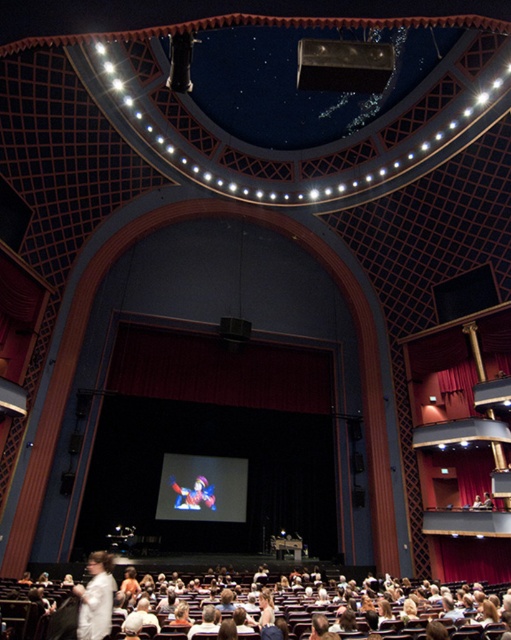
Question: Does white fabric coat at lower center appear on the left side of multicolored plush toy at center?

Choices:
 (A) no
 (B) yes

Answer: (A)

Question: Is white fabric coat at lower center to the right of multicolored plush toy at center from the viewer's perspective?

Choices:
 (A) yes
 (B) no

Answer: (A)

Question: Based on their relative distances, which object is farther from the white fabric coat at lower center?

Choices:
 (A) white matte shirt at lower left
 (B) multicolored plush toy at center

Answer: (B)

Question: Which is nearer to the white matte shirt at lower left?

Choices:
 (A) white fabric coat at lower center
 (B) multicolored plush toy at center

Answer: (A)

Question: Can you confirm if white matte shirt at lower left is positioned to the right of multicolored plush toy at center?

Choices:
 (A) no
 (B) yes

Answer: (B)

Question: Considering the real-world distances, which object is farthest from the white matte shirt at lower left?

Choices:
 (A) white fabric coat at lower center
 (B) multicolored plush toy at center

Answer: (B)